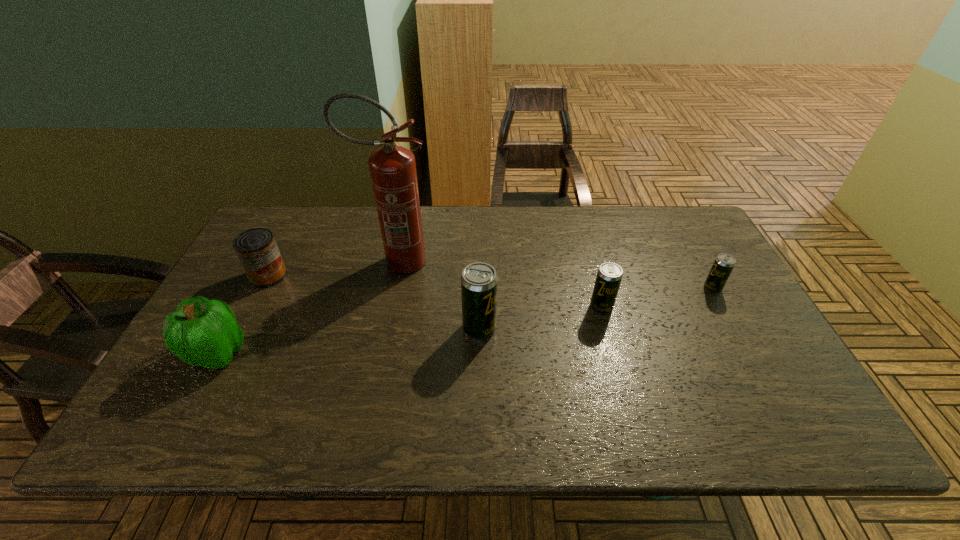
Considering the uniform spacing of beer cans, where should an additional beer can be positioned on the left? Please locate a free spot. Please provide its 2D coordinates. Your answer should be formatted as a tuple, i.e. [(x, y)], where the tuple contains the x and y coordinates of a point satisfying the conditions above.

[(346, 352)]